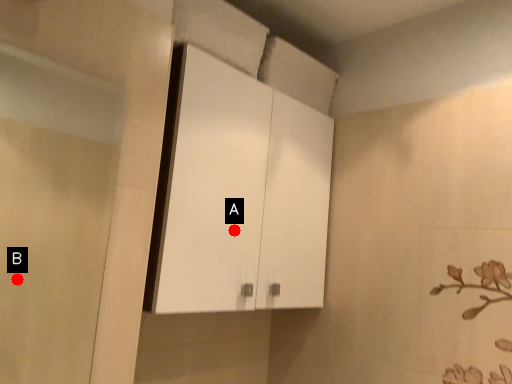
Question: Two points are circled on the image, labeled by A and B beside each circle. Which of the following is the farthest from the observer?

Choices:
 (A) A is further
 (B) B is further

Answer: (B)